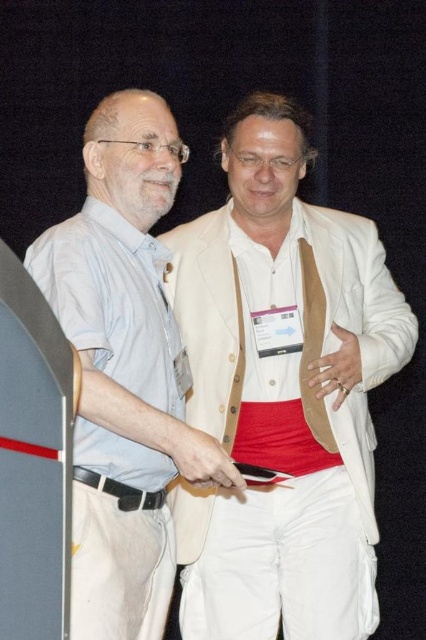
Is white cotton blazer at center shorter than black leather belt at lower left?

No.

Is point (319, 506) behind point (132, 502)?

Yes, it is.

Identify the location of white cotton blazer at center. (282, 392).

Which is below, matte light blue shirt at left or black leather belt at lower left?

black leather belt at lower left is below.

Does point (94, 298) lie behind point (114, 484)?

No, it is not.

Image resolution: width=426 pixels, height=640 pixels. In order to click on matte light blue shirt at left in this screenshot , I will do `click(126, 301)`.

Can you confirm if white cotton blazer at center is taller than matte light blue shirt at left?

Indeed, white cotton blazer at center has a greater height compared to matte light blue shirt at left.

Which of these two, white cotton blazer at center or matte light blue shirt at left, stands shorter?

Standing shorter between the two is matte light blue shirt at left.

Is point (187, 529) farther from viewer compared to point (126, 420)?

That is True.

At what (x,y) coordinates should I click in order to perform the action: click on white cotton blazer at center. Please return your answer as a coordinate pair (x, y). This screenshot has width=426, height=640. Looking at the image, I should click on (282, 392).